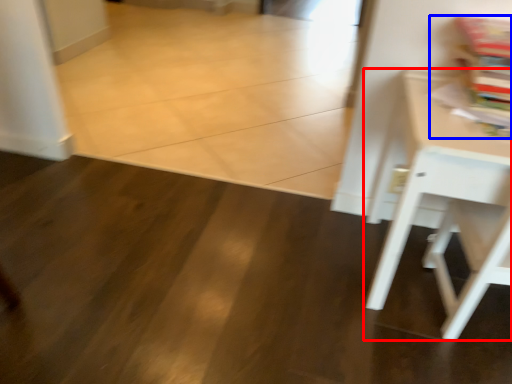
Question: Which of the following is the closest to the observer, table (highlighted by a red box) or magazine (highlighted by a blue box)?

Choices:
 (A) table
 (B) magazine

Answer: (A)